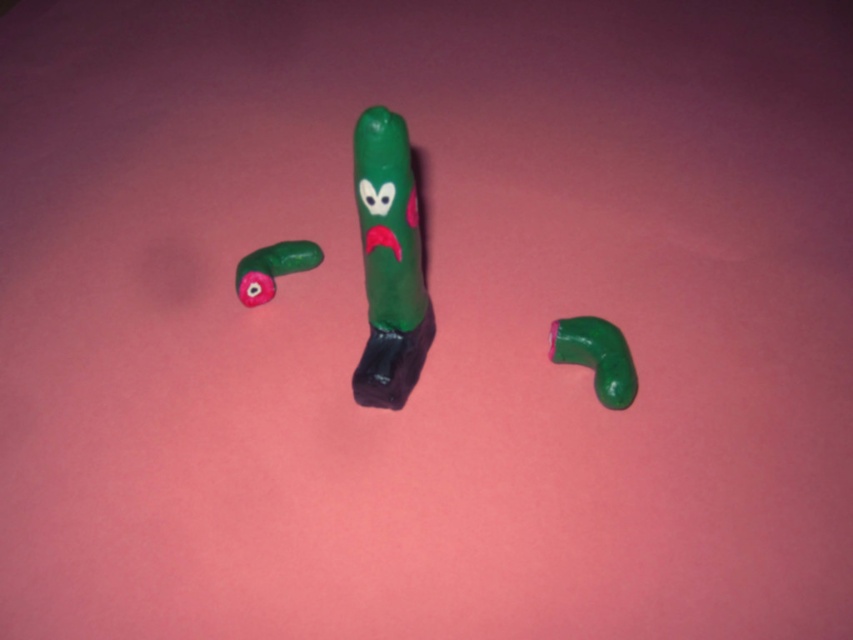
What is located at the coordinates point (389, 262) in the image?

The point (389, 262) indicates the green matte plastic toy at center.